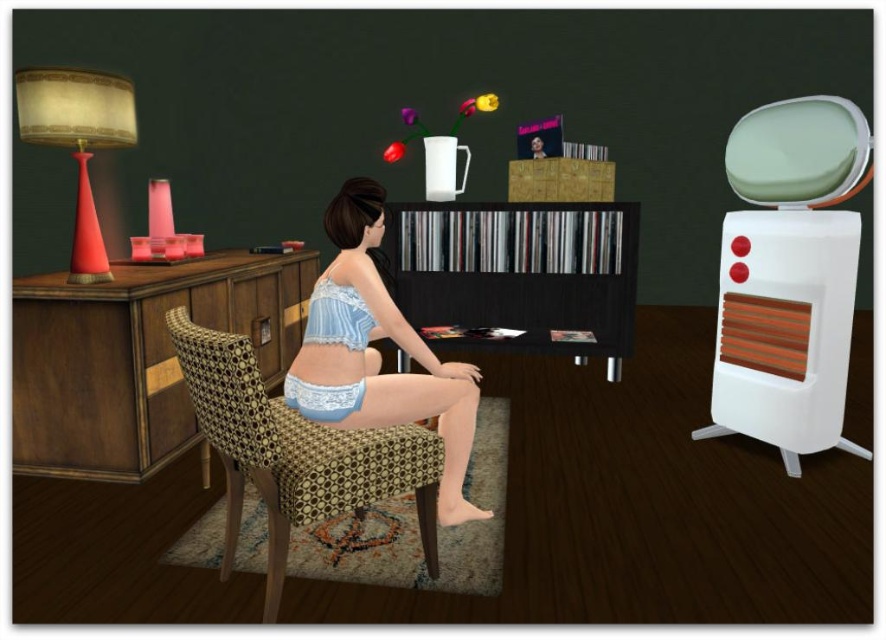
Can you confirm if black wood bookshelf at center is positioned to the right of lacy white underwear at center?

Indeed, black wood bookshelf at center is positioned on the right side of lacy white underwear at center.

Consider the image. Who is higher up, black wood bookshelf at center or lacy white underwear at center?

black wood bookshelf at center is above.

This screenshot has width=886, height=640. What are the coordinates of `black wood bookshelf at center` in the screenshot? It's located at (519, 273).

Is wooden bookshelf at center to the right of lace fabric lingerie at center from the viewer's perspective?

Incorrect, wooden bookshelf at center is not on the right side of lace fabric lingerie at center.

From the picture: Between wooden bookshelf at center and lace fabric lingerie at center, which one has more height?

Standing taller between the two is lace fabric lingerie at center.

Locate an element on the screen. The image size is (886, 640). wooden bookshelf at center is located at coordinates (136, 356).

Find the location of `wooden bookshelf at center`. wooden bookshelf at center is located at coordinates (136, 356).

Consider the image. Is matte red lampshade at left smaller than lacy white underwear at center?

Actually, matte red lampshade at left might be larger than lacy white underwear at center.

Is point (87, 204) closer to viewer compared to point (330, 390)?

No, it is not.

I want to click on matte red lampshade at left, so click(76, 141).